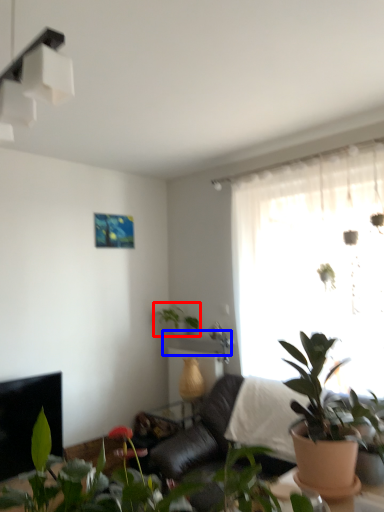
Question: Which of the following is the farthest to the observer, houseplant (highlighted by a red box) or window sill (highlighted by a blue box)?

Choices:
 (A) houseplant
 (B) window sill

Answer: (A)